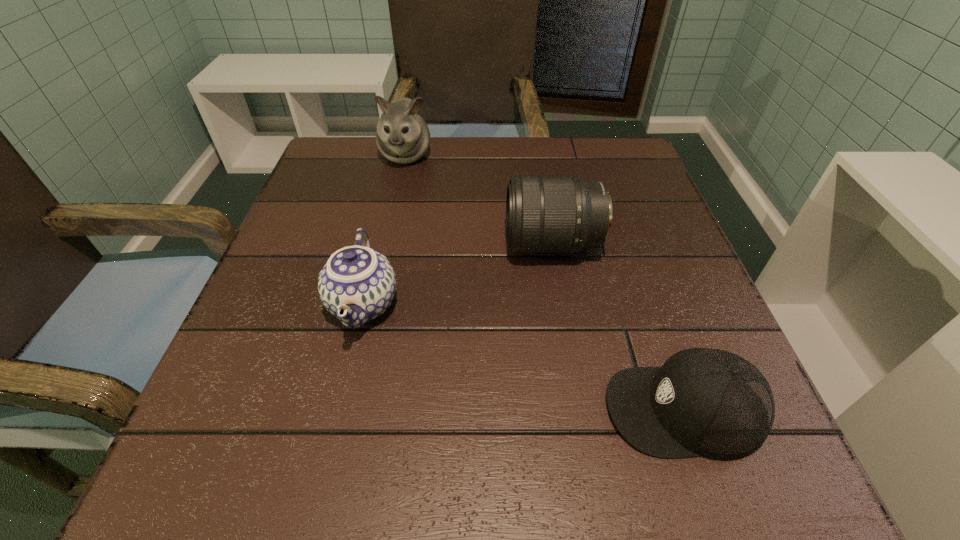
Image resolution: width=960 pixels, height=540 pixels. Find the location of `object positioned at the near right corner`. object positioned at the near right corner is located at coordinates (707, 402).

You are a GUI agent. You are given a task and a screenshot of the screen. Output one action in this format:
    pyautogui.click(x=<x>, y=<y>)
    Task: Click on the free space at the far edge of the desktop
    
    Given the screenshot: What is the action you would take?
    coord(422,185)

Where is `vacant space at the left edge of the desktop`? vacant space at the left edge of the desktop is located at coordinates (300, 202).

In the image, there is a desktop. Where is `vacant space at the right edge`? The image size is (960, 540). vacant space at the right edge is located at coordinates tap(631, 227).

I want to click on vacant area at the far left corner, so click(x=322, y=179).

In the image, there is a desktop. What are the coordinates of `free space at the far right corner` in the screenshot? It's located at (603, 153).

Where is `empty location between the telephoto lens and the second shortest object`? This screenshot has width=960, height=540. empty location between the telephoto lens and the second shortest object is located at coordinates (458, 274).

This screenshot has height=540, width=960. I want to click on empty space between the shortest object and the farthest object, so click(544, 282).

Locate an element on the screen. This screenshot has height=540, width=960. vacant space in between the telephoto lens and the hamster is located at coordinates (479, 200).

The image size is (960, 540). I want to click on empty space that is in between the shortest object and the chinaware, so click(x=523, y=356).